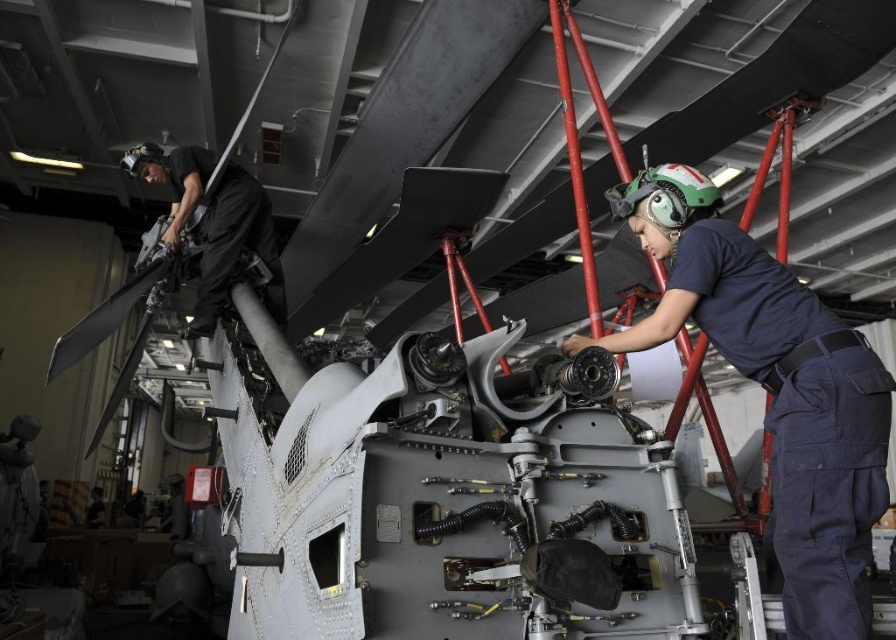
Can you confirm if navy blue uniform at center is smaller than black fabric helmet at upper left?

Correct, navy blue uniform at center occupies less space than black fabric helmet at upper left.

Does navy blue uniform at center have a lesser height compared to black fabric helmet at upper left?

Incorrect, navy blue uniform at center's height does not fall short of black fabric helmet at upper left's.

Locate an element on the screen. Image resolution: width=896 pixels, height=640 pixels. navy blue uniform at center is located at coordinates (774, 388).

Locate an element on the screen. This screenshot has height=640, width=896. navy blue uniform at center is located at coordinates (774, 388).